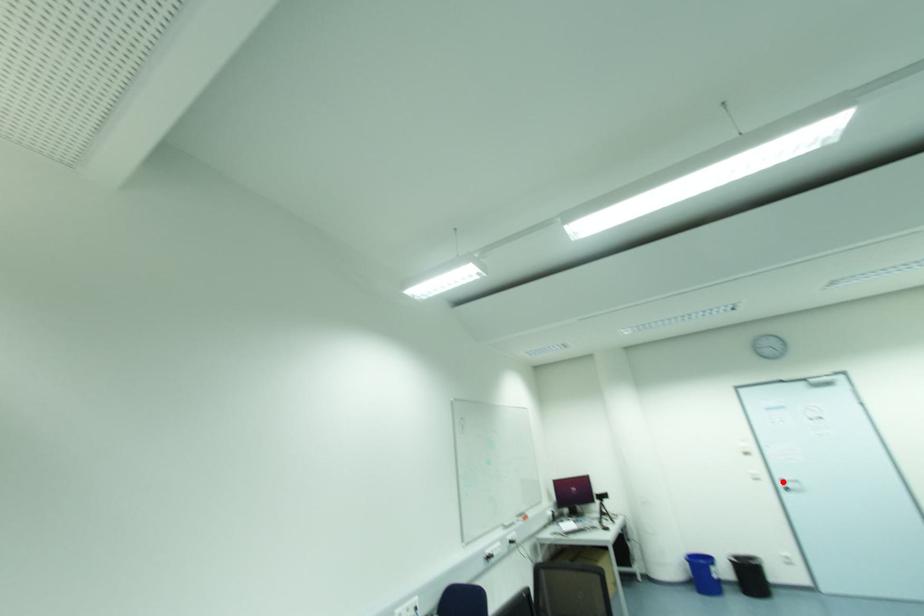
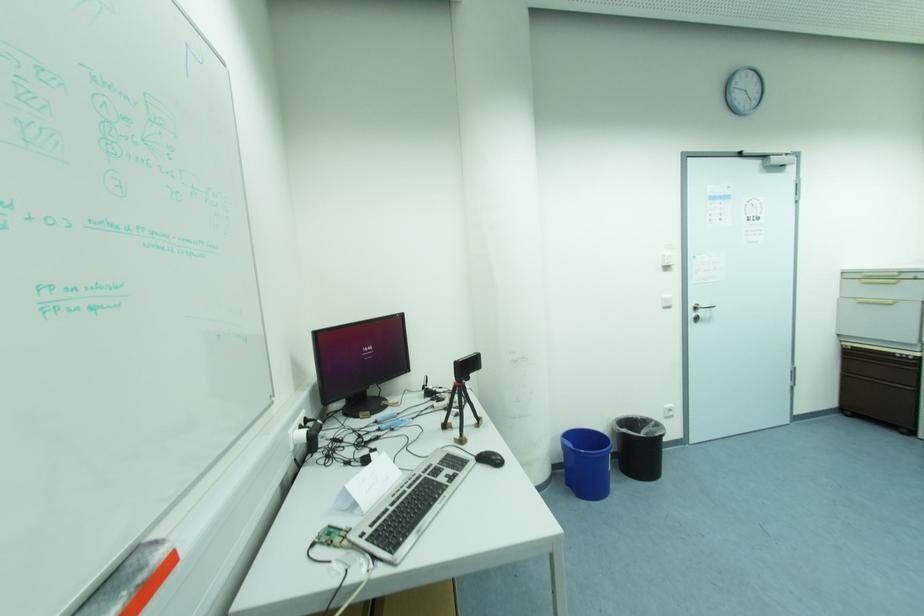
Locate, in the second image, the point that corresponds to the highlighted location in the first image.

(697, 309)